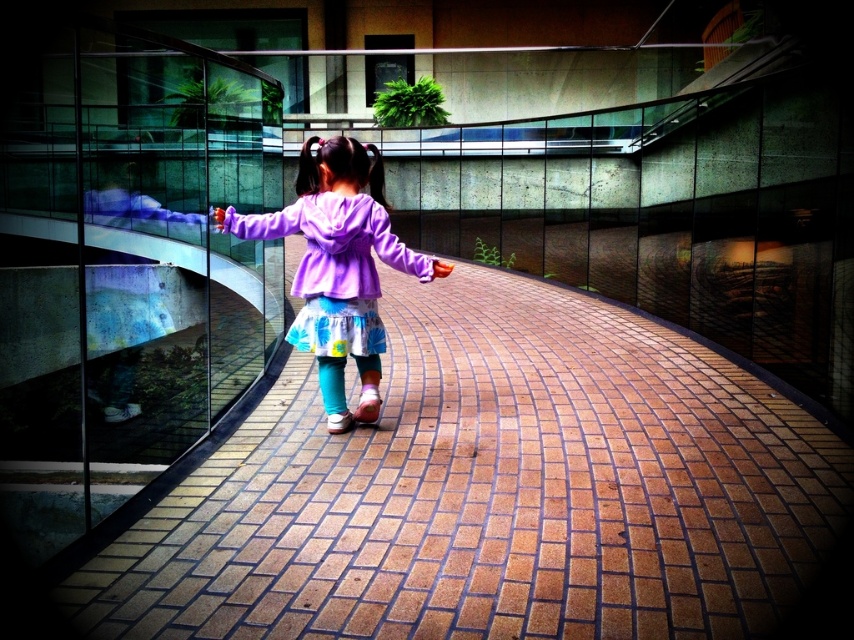
Is brick at center in front of purple fleece jacket at center?

Yes, brick at center is in front of purple fleece jacket at center.

Who is more forward, (618, 627) or (393, 241)?

Point (618, 627)

Find the location of a particular element. This screenshot has width=854, height=640. brick at center is located at coordinates (490, 490).